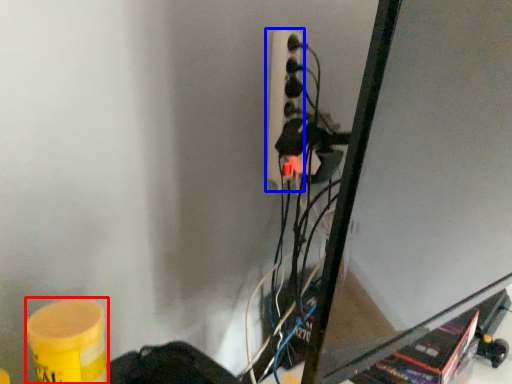
Question: Which of the following is the farthest to the observer, barrel (highlighted by a red box) or power plugs and sockets (highlighted by a blue box)?

Choices:
 (A) barrel
 (B) power plugs and sockets

Answer: (B)